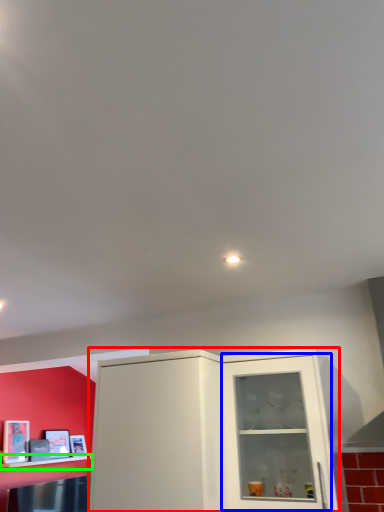
Question: Estimate the real-world distances between objects in this image. Which object is closer to cabinetry (highlighted by a red box), glass door (highlighted by a blue box) or shelf (highlighted by a green box)?

Choices:
 (A) glass door
 (B) shelf

Answer: (A)